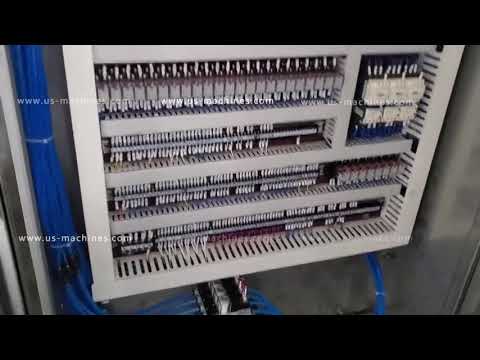
Identify the location of bottom right corner of cabinet. (470, 313).